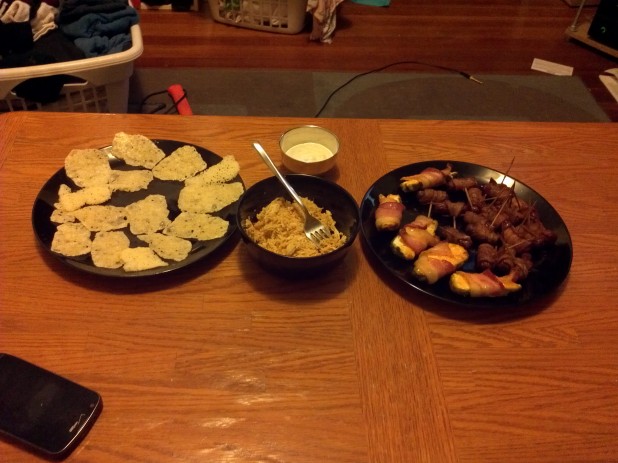
Locate an element on the screen. The image size is (618, 463). hardwod floor is located at coordinates tap(392, 32).